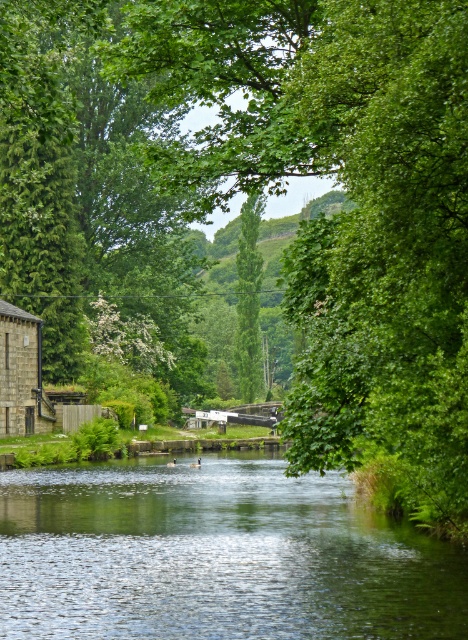
Is point (50, 541) in front of point (245, 253)?

That is True.

Between green glossy water at center and green leafy tree at center, which one appears on the left side from the viewer's perspective?

Positioned to the left is green glossy water at center.

You are a GUI agent. You are given a task and a screenshot of the screen. Output one action in this format:
    pyautogui.click(x=<x>, y=<y>)
    Task: Click on the green glossy water at center
    Image resolution: width=468 pixels, height=640 pixels.
    Given the screenshot: What is the action you would take?
    pyautogui.click(x=216, y=556)

Locate an element on the screen. green glossy water at center is located at coordinates (216, 556).

Between green glossy water at center and stone brick hut at left, which one has more height?

stone brick hut at left is taller.

Where is `green glossy water at center`? This screenshot has height=640, width=468. green glossy water at center is located at coordinates (216, 556).

Locate an element on the screen. The width and height of the screenshot is (468, 640). green glossy water at center is located at coordinates (216, 556).

Is stone brick hut at left positioned before green leafy tree at center?

Yes, stone brick hut at left is in front of green leafy tree at center.

Which of these two, stone brick hut at left or green leafy tree at center, stands taller?

green leafy tree at center is taller.

Which is in front, point (30, 372) or point (251, 310)?

Point (30, 372) is in front.

Identify the location of stone brick hut at left. (21, 374).